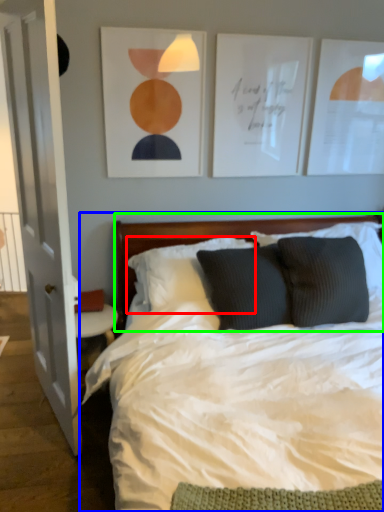
Question: Which is nearer to the pillow (highlighted by a red box)? bed (highlighted by a blue box) or headboard (highlighted by a green box).

Choices:
 (A) bed
 (B) headboard

Answer: (B)